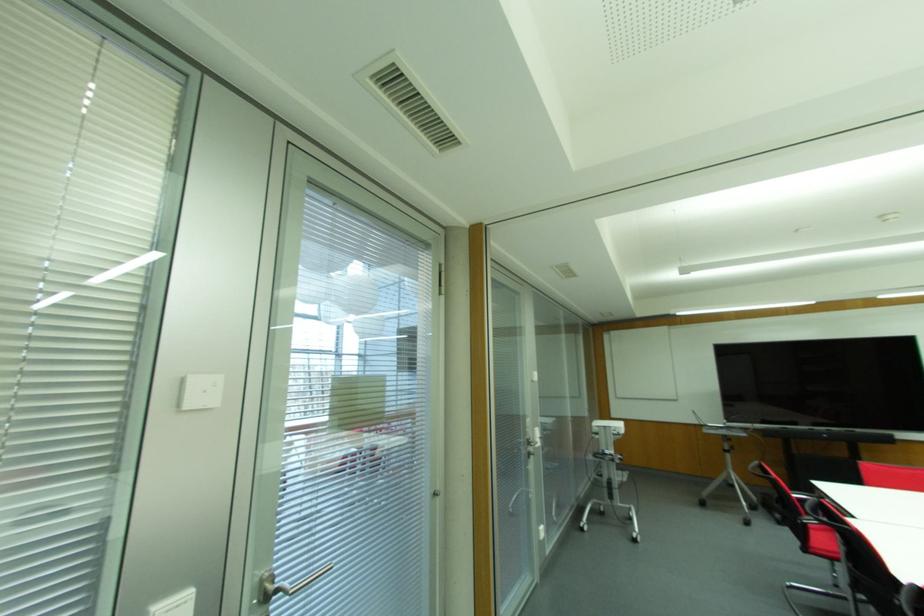
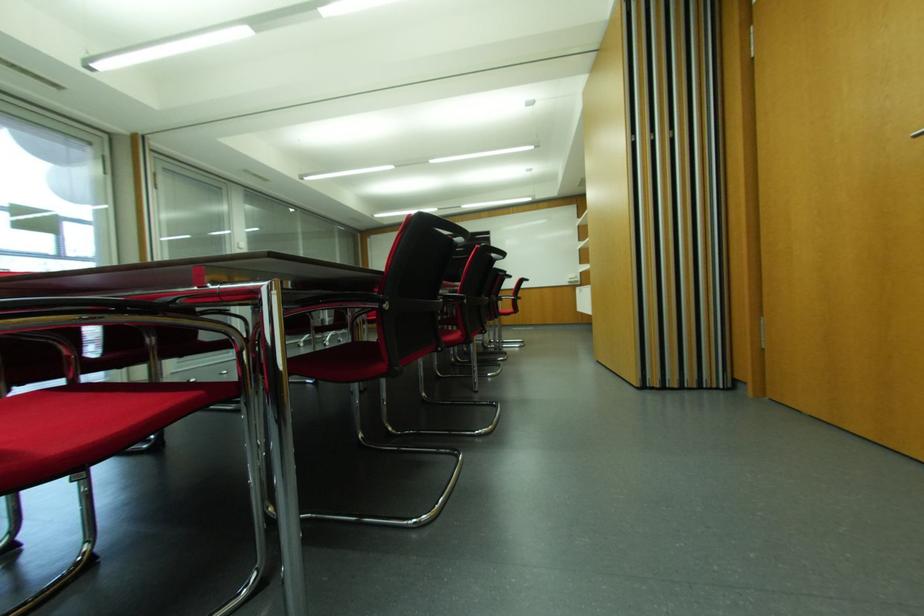
Which direction would the cameraman need to move to produce the second image?

The cameraman moved toward right, backward.